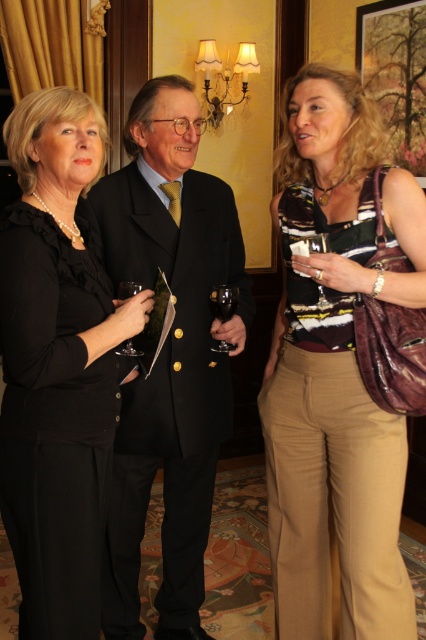
You are at a formal event and notice two items at the center of the scene. Which item is taller between the striped jersey at center and the translucent glass at center?

The striped jersey at center is taller than the translucent glass at center according to the description.

Based on the scene description, which object is positioned lower in the image between the black wool suit at center and the translucent glass at center?

The black wool suit at center is positioned lower than the translucent glass at center in the image.